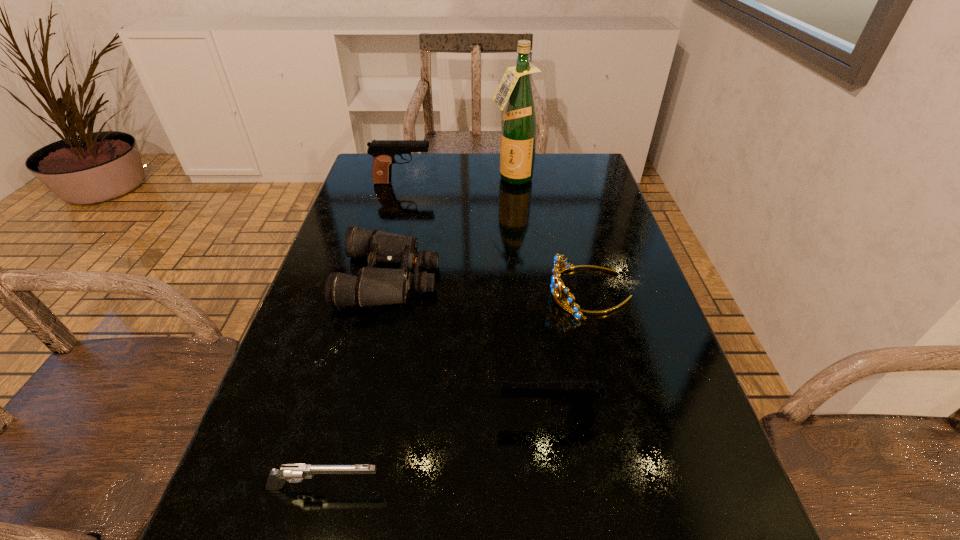
Locate an element on the screen. the tallest object is located at coordinates (519, 124).

Identify the location of the second tallest object. This screenshot has width=960, height=540. (383, 151).

Locate an element on the screen. the farthest pistol is located at coordinates (383, 151).

This screenshot has width=960, height=540. In order to click on tiara in this screenshot , I will do `click(555, 285)`.

Locate an element on the screen. The width and height of the screenshot is (960, 540). the fifth farthest object is located at coordinates pyautogui.click(x=579, y=395).

The image size is (960, 540). Identify the location of the rightmost pistol. (579, 395).

This screenshot has width=960, height=540. In order to click on binoculars in this screenshot , I will do `click(374, 286)`.

The width and height of the screenshot is (960, 540). What are the coordinates of `the nearest pistol` in the screenshot? It's located at (291, 472).

Locate an element on the screen. This screenshot has width=960, height=540. the shortest pistol is located at coordinates (291, 472).

This screenshot has height=540, width=960. I want to click on vacant space located 0.090m on the front-facing side of the tallest object, so click(x=515, y=205).